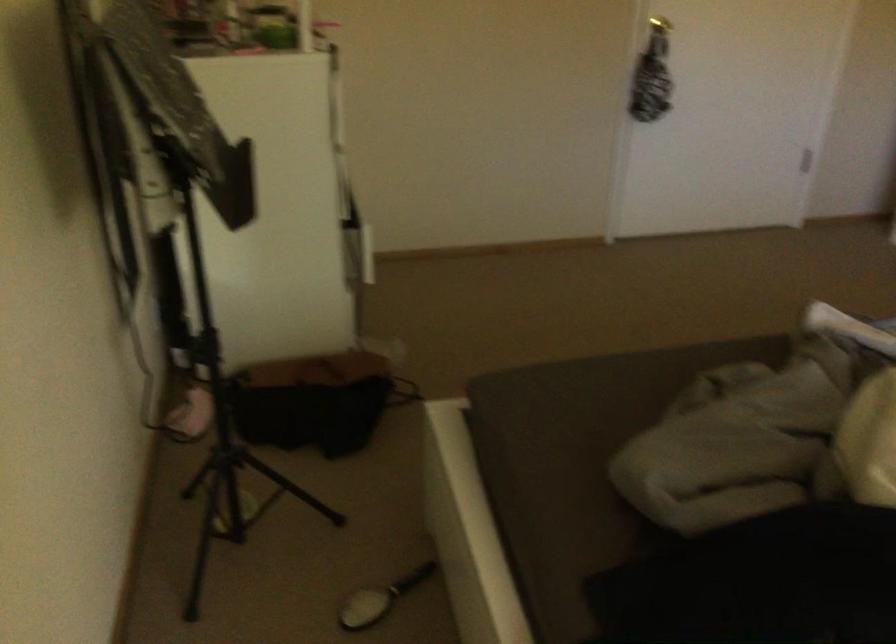
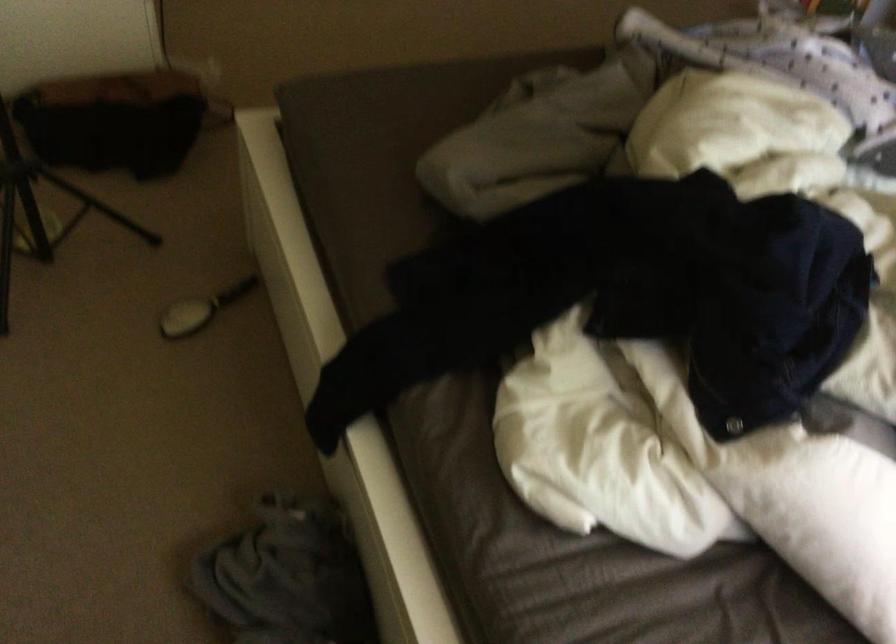
The images are taken continuously from a first-person perspective. In which direction are you moving?

The cameraman walked toward right, backward.